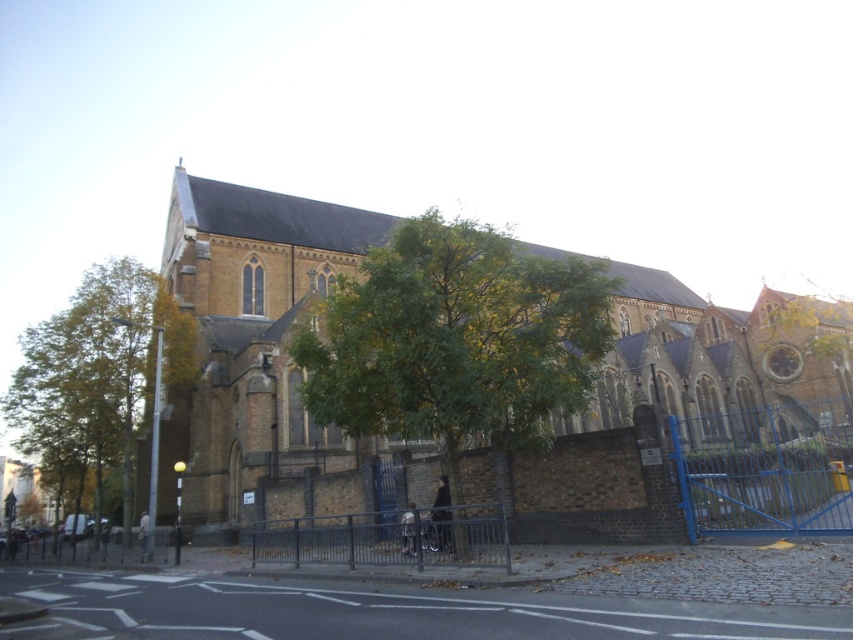
You are standing in front of the church and want to enter the courtyard. You see the green leafy tree at center and the silver metallic fence at center. Which object is closer to you?

The green leafy tree at center is closer to you because the silver metallic fence at center is behind it.

From the picture: You are standing in front of the brown brick church at center and the green leafy tree at center. Which object is positioned more to the east side of the scene?

The brown brick church at center is to the right of green leafy tree at center, so the green leafy tree at center is positioned more to the east side of the scene.